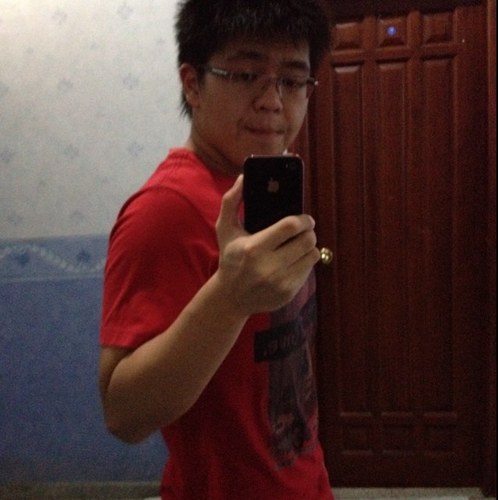
Identify the location of floor. The height and width of the screenshot is (500, 498). (397, 487).